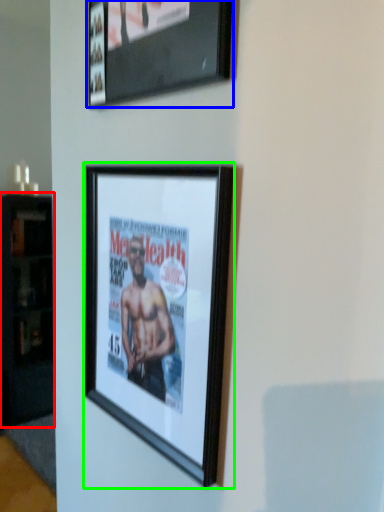
Question: Based on their relative distances, which object is farther from cabinetry (highlighted by a red box)? Choose from picture frame (highlighted by a blue box) and picture frame (highlighted by a green box).

Choices:
 (A) picture frame
 (B) picture frame

Answer: (A)